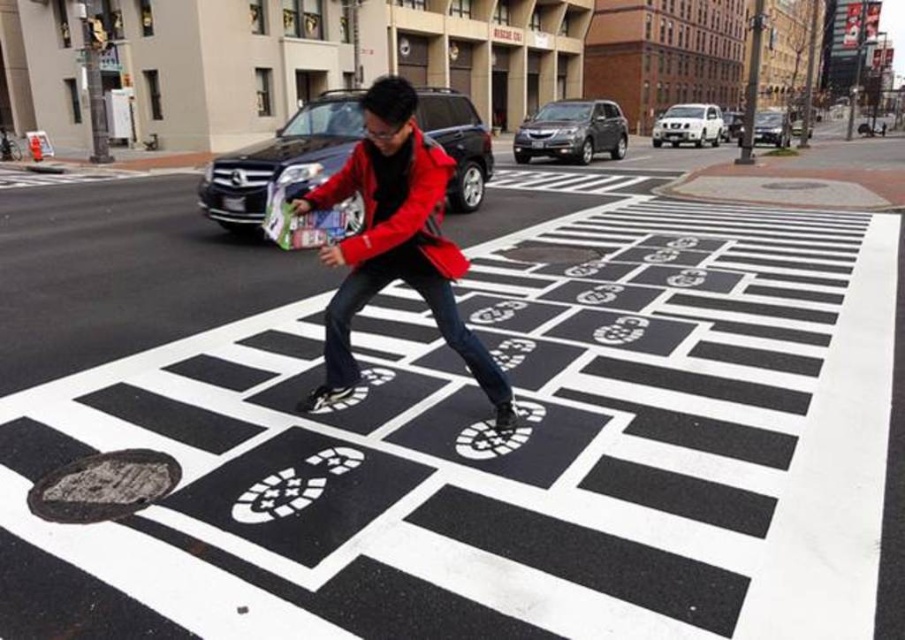
Between point (551, 312) and point (450, 168), which one is positioned behind?

The point (551, 312) is behind.

What are the coordinates of `black asphalt at center` in the screenshot? It's located at (501, 451).

The width and height of the screenshot is (905, 640). Identify the location of black asphalt at center. (501, 451).

Does red matte jacket at center have a smaller size compared to matte red jacket at center?

Indeed, red matte jacket at center has a smaller size compared to matte red jacket at center.

Is the position of red matte jacket at center less distant than that of matte red jacket at center?

That is True.

The image size is (905, 640). What do you see at coordinates (395, 241) in the screenshot? I see `red matte jacket at center` at bounding box center [395, 241].

Image resolution: width=905 pixels, height=640 pixels. I want to click on red matte jacket at center, so click(x=395, y=241).

Is point (774, 540) closer to camera compared to point (502, 428)?

Yes, it is in front of point (502, 428).

Who is more distant from viewer, (472, 513) or (446, 330)?

The point (446, 330) is more distant.

Who is more distant from viewer, (683, 556) or (350, 314)?

The point (350, 314) is behind.

Where is `black asphalt at center`? The height and width of the screenshot is (640, 905). black asphalt at center is located at coordinates (501, 451).